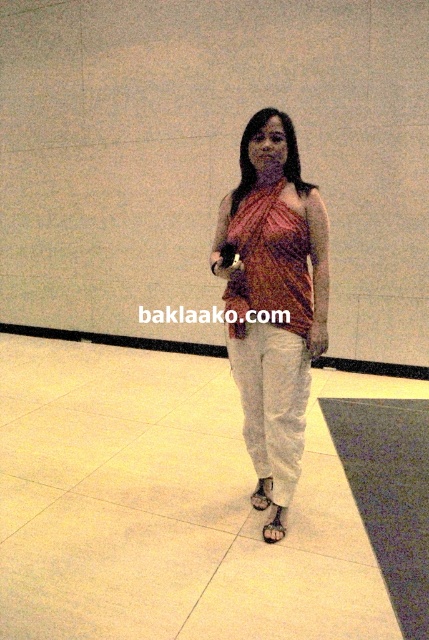
You are a photographer setting up a shoot in the room described. You notice the brown leather sandal at lower center and the black leather sandal at lower center. Which sandal is positioned to the right of the other?

The brown leather sandal at lower center is positioned on the right side of black leather sandal at lower center.

You are a photographer trying to capture the person standing in the image. You notice the brown leather sandal at lower center and the black leather sandal at lower center. Which sandal is covering the other one?

The brown leather sandal at lower center is positioned under the black leather sandal at lower center, so the black leather sandal is covering the brown one.

You are a photographer setting up for a shoot. You need to place a 24 inch wide prop between the pink fabric dress at center and the brown leather sandal at lower center. Is there enough space between them to fit the prop?

The distance between the pink fabric dress at center and the brown leather sandal at lower center is 27.00 inches. Since the prop is 24 inches wide, there is enough space to place it between them.